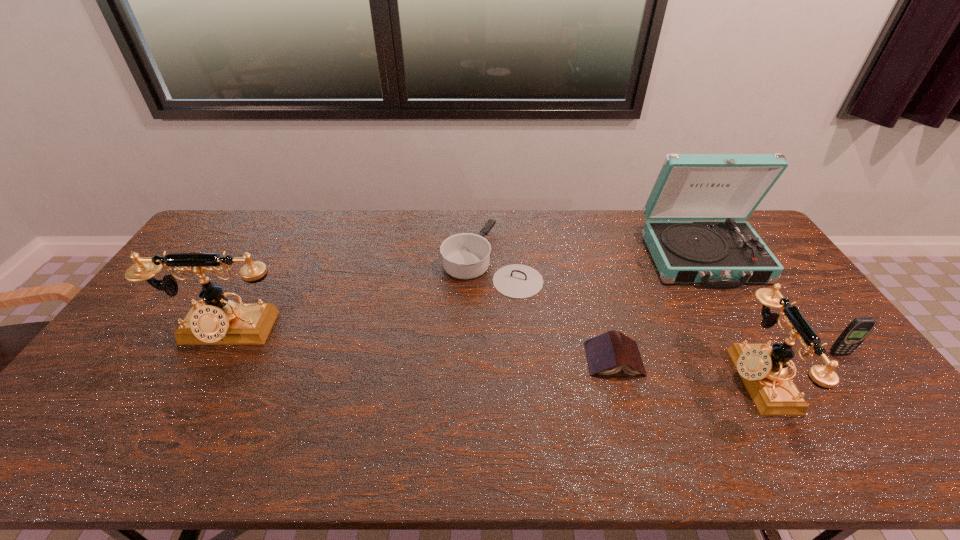
Where is `the left telephone`? Image resolution: width=960 pixels, height=540 pixels. the left telephone is located at coordinates (216, 321).

At what (x,y) coordinates should I click in order to perform the action: click on the leftmost object. Please return your answer as a coordinate pair (x, y). This screenshot has width=960, height=540. Looking at the image, I should click on (216, 321).

The width and height of the screenshot is (960, 540). Find the location of `the fourth shortest object`. the fourth shortest object is located at coordinates (763, 369).

Find the location of a particular element. the shorter telephone is located at coordinates (763, 369).

What are the coordinates of `saucepan` in the screenshot? It's located at (466, 255).

What are the coordinates of `the second object from left to right` in the screenshot? It's located at (466, 255).

This screenshot has height=540, width=960. Identify the location of the tallest object. (718, 254).

Locate an element on the screen. cellular telephone is located at coordinates (855, 333).

Identify the location of the rightmost object. (855, 333).

Where is `book`? This screenshot has height=540, width=960. book is located at coordinates (608, 353).